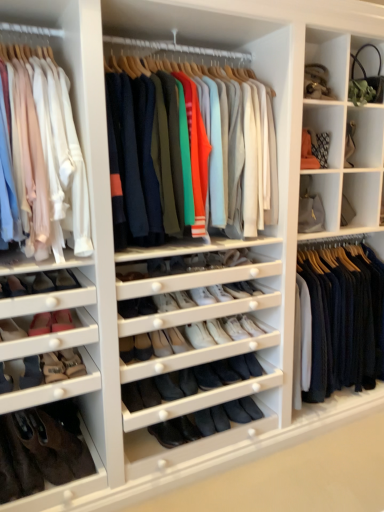
Question: Is the position of suede brown shoe at lower left, the 4th shoe positioned from the right, more distant than that of knit sweater at center, acting as the 2th clothing starting from the left?

Choices:
 (A) yes
 (B) no

Answer: (A)

Question: Is the depth of suede brown shoe at lower left, which is the 7th shoe in left-to-right order, less than that of knit sweater at center, placed as the second clothing when sorted from right to left?

Choices:
 (A) no
 (B) yes

Answer: (A)

Question: Does suede brown shoe at lower left, the 4th shoe positioned from the right, appear on the left side of knit sweater at center, placed as the second clothing when sorted from right to left?

Choices:
 (A) yes
 (B) no

Answer: (A)

Question: Is suede brown shoe at lower left, which is the 7th shoe in left-to-right order, looking in the opposite direction of knit sweater at center, acting as the 2th clothing starting from the left?

Choices:
 (A) yes
 (B) no

Answer: (B)

Question: From a real-world perspective, is suede brown shoe at lower left, the 4th shoe positioned from the right, over knit sweater at center, acting as the 2th clothing starting from the left?

Choices:
 (A) yes
 (B) no

Answer: (B)

Question: Considering the positions of suede brown shoe at lower left, which is the 7th shoe in left-to-right order, and matte pink shoe at lower left, placed as the fourth shoe when sorted from left to right, in the image, is suede brown shoe at lower left, which is the 7th shoe in left-to-right order, taller or shorter than matte pink shoe at lower left, placed as the fourth shoe when sorted from left to right,?

Choices:
 (A) short
 (B) tall

Answer: (B)

Question: In terms of width, does suede brown shoe at lower left, which is the 7th shoe in left-to-right order, look wider or thinner when compared to matte pink shoe at lower left, which is counted as the seventh shoe, starting from the right?

Choices:
 (A) wide
 (B) thin

Answer: (B)

Question: From the image's perspective, is suede brown shoe at lower left, the 4th shoe positioned from the right, above or below matte pink shoe at lower left, which is counted as the seventh shoe, starting from the right?

Choices:
 (A) above
 (B) below

Answer: (B)

Question: Is point (66, 352) positioned closer to the camera than point (23, 289)?

Choices:
 (A) closer
 (B) farther

Answer: (B)

Question: From a real-world perspective, is brown suede shoe at lower left, arranged as the 8th shoe when viewed from the right, positioned above or below suede black shoe at lower left, positioned as the 10th shoe in right-to-left order?

Choices:
 (A) above
 (B) below

Answer: (B)

Question: Is point (18, 453) closer or farther from the camera than point (0, 371)?

Choices:
 (A) farther
 (B) closer

Answer: (A)

Question: Looking at their shapes, would you say brown suede shoe at lower left, placed as the third shoe when sorted from left to right, is wider or thinner than suede black shoe at lower left, which is the first shoe in left-to-right order?

Choices:
 (A) wide
 (B) thin

Answer: (B)

Question: Considering the relative positions of brown suede shoe at lower left, placed as the third shoe when sorted from left to right, and suede black shoe at lower left, positioned as the 10th shoe in right-to-left order, in the image provided, is brown suede shoe at lower left, placed as the third shoe when sorted from left to right, to the left or to the right of suede black shoe at lower left, positioned as the 10th shoe in right-to-left order,?

Choices:
 (A) right
 (B) left

Answer: (A)

Question: Is suede black shoe at lower left, positioned as the 10th shoe in right-to-left order, wider or thinner than leather boot at lower left?

Choices:
 (A) wide
 (B) thin

Answer: (B)

Question: Is suede black shoe at lower left, positioned as the 10th shoe in right-to-left order, taller or shorter than leather boot at lower left?

Choices:
 (A) tall
 (B) short

Answer: (B)